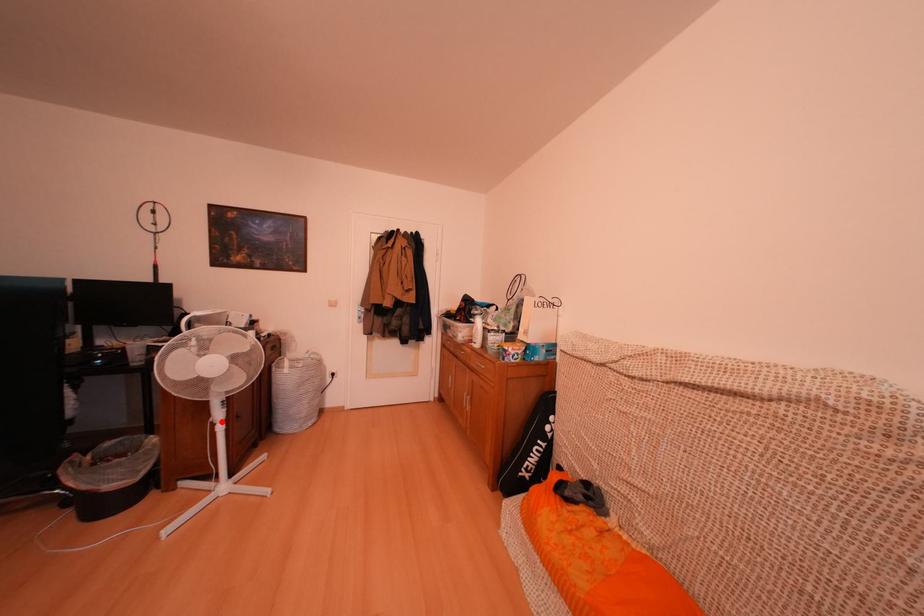
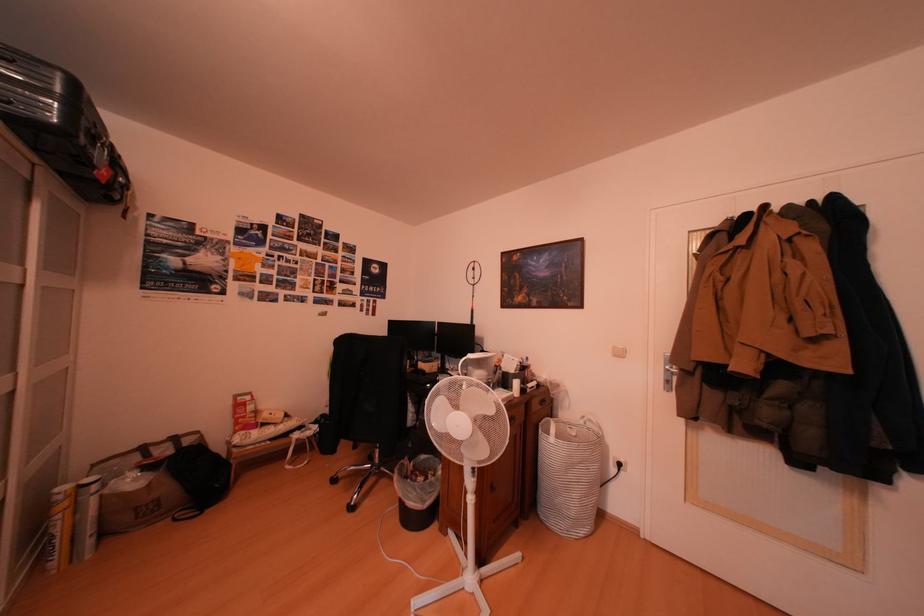
Question: I am providing you with two images of the same scene from different viewpoints. Image1 has a red point marked. In image2, the corresponding 3D location appears at what relative position? Reply with the corresponding letter.

Choices:
 (A) Closer
 (B) Farther

Answer: (B)